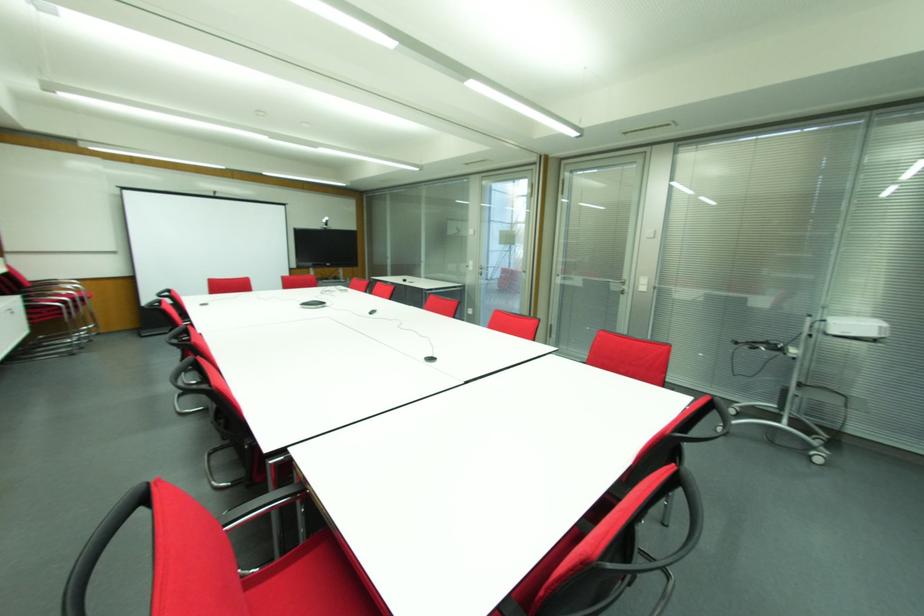
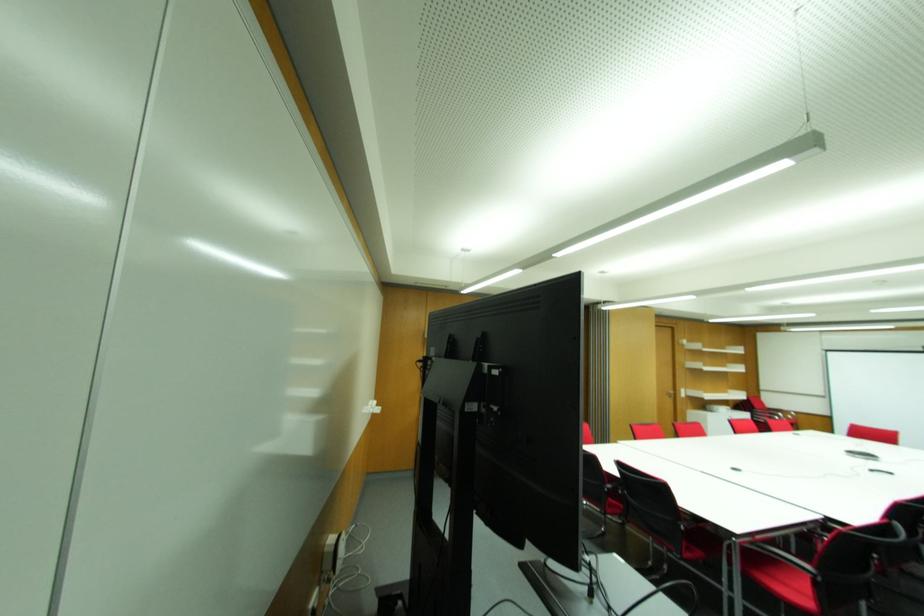
Question: I am providing you with two images of the same scene from different viewpoints. After the viewpoint changes to image2, which objects are now occluded?

Choices:
 (A) black table lamp
 (B) black chair armrest
 (C) red chair sitting surface
 (D) metal door handle

Answer: (B)